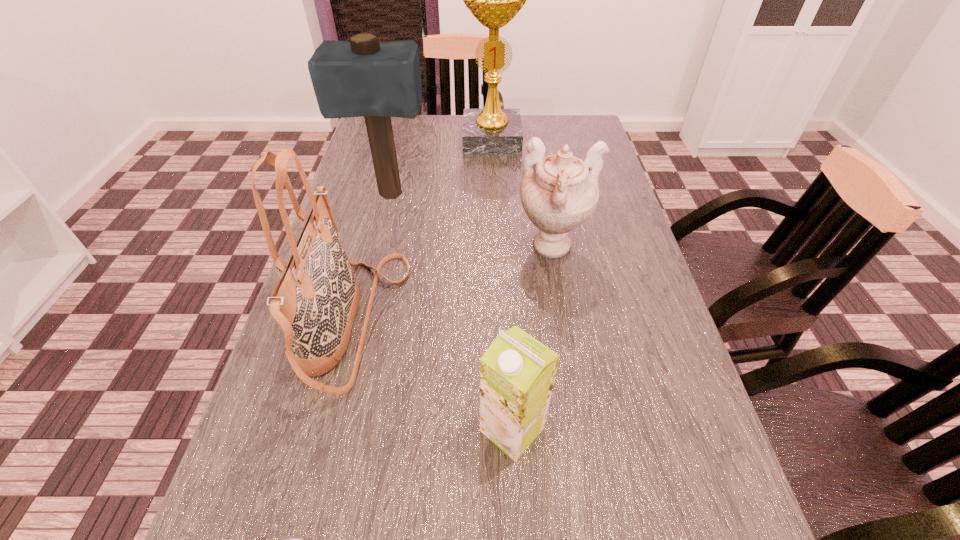
Locate an element on the screen. the farthest object is located at coordinates (494, 0).

Find the location of a particular element. The height and width of the screenshot is (540, 960). the fifth nearest object is located at coordinates pyautogui.click(x=362, y=77).

Identify the location of handbag. The image size is (960, 540). (315, 302).

This screenshot has width=960, height=540. I want to click on urn, so click(x=559, y=192).

The image size is (960, 540). I want to click on soya milk, so click(517, 372).

Identify the location of vacant space located on the front-facing side of the farthest object. This screenshot has height=540, width=960. coord(493,186).

This screenshot has width=960, height=540. In order to click on free spot located 0.400m on the right of the mallet in this screenshot , I will do `click(575, 195)`.

You are a GUI agent. You are given a task and a screenshot of the screen. Output one action in this format:
    pyautogui.click(x=<x>, y=<y>)
    Task: Click on the free spot located on the front-facing side of the handbag
    This screenshot has width=960, height=540.
    Given the screenshot: What is the action you would take?
    pyautogui.click(x=456, y=323)

The height and width of the screenshot is (540, 960). In order to click on blank space located 0.100m on the front of the urn in this screenshot , I will do `click(564, 311)`.

I want to click on free space located on the back of the soya milk, so click(510, 376).